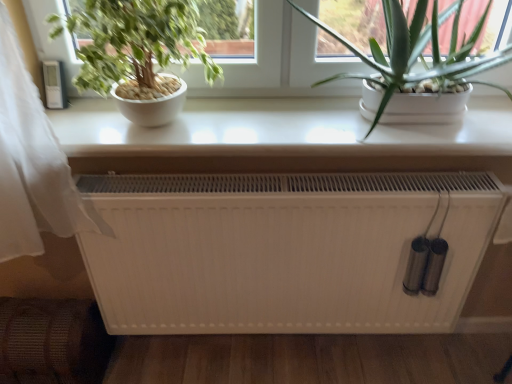
Question: Is green matte plant at left, the 2th houseplant from the right, taller or shorter than green leafy plant at upper left?

Choices:
 (A) tall
 (B) short

Answer: (A)

Question: Considering the positions of green matte plant at left, which appears as the first houseplant when viewed from the left, and green leafy plant at upper left in the image, is green matte plant at left, which appears as the first houseplant when viewed from the left, bigger or smaller than green leafy plant at upper left?

Choices:
 (A) big
 (B) small

Answer: (A)

Question: Based on their relative distances, which object is nearer to the white matte heater at center?

Choices:
 (A) green matte plant at left, which appears as the first houseplant when viewed from the left
 (B) green leafy plant at upper right, which is the 2th houseplant from left to right
 (C) green leafy plant at upper left
 (D) white glossy table at upper center

Answer: (D)

Question: Estimate the real-world distances between objects in this image. Which object is closer to the white glossy table at upper center?

Choices:
 (A) green leafy plant at upper left
 (B) white matte heater at center
 (C) green leafy plant at upper right, acting as the first houseplant starting from the right
 (D) green matte plant at left, which appears as the first houseplant when viewed from the left

Answer: (A)